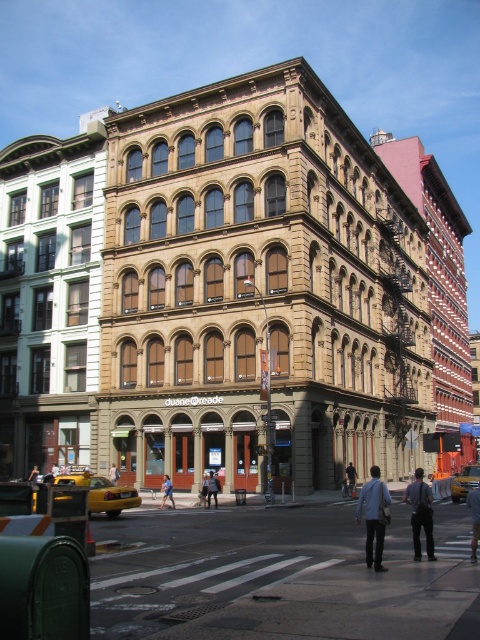
You are a delivery person who needs to place a package on a shelf that can only hold items up to 1.2 meters in height. You have two options available for placement near the building depicted in the scene. The first option is the light blue denim jacket at center, and the second is the denim jacket at lower right. Based on their sizes, which jacket can safely be placed on the shelf without exceeding the height limit?

The denim jacket at lower right can safely be placed on the shelf since it is shorter than the light blue denim jacket at center, which is much taller and likely exceeds the 1.2 meter height limit.